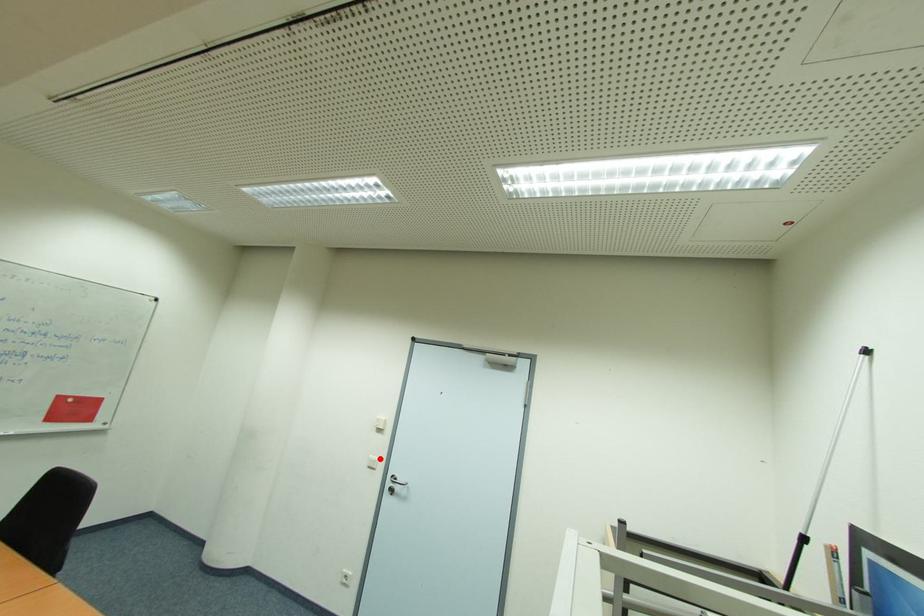
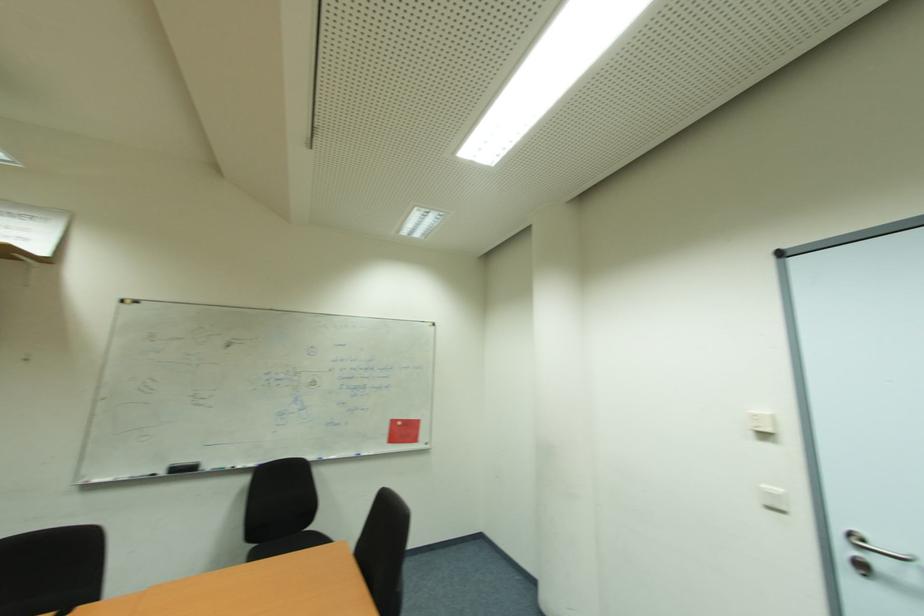
Where in the second image is the point corresponding to the highlighted location from the first image?

(784, 492)